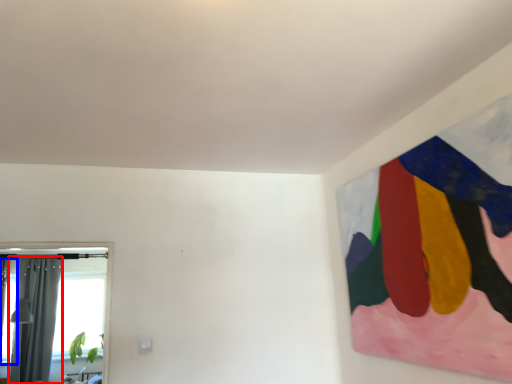
Question: Which object appears closest to the camera in this image, curtain (highlighted by a red box) or window (highlighted by a blue box)?

Choices:
 (A) curtain
 (B) window

Answer: (B)